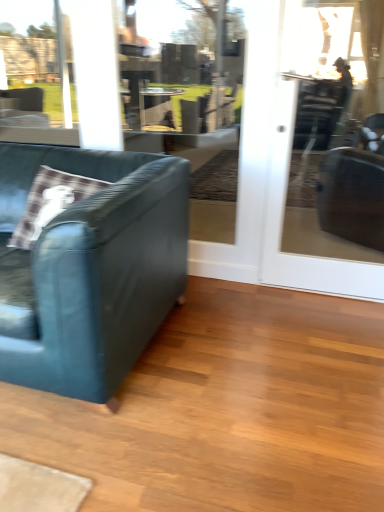
Locate an element on the screen. This screenshot has height=512, width=384. free point below transparent glass screen door at center (from a real-world perspective) is located at coordinates (319, 293).